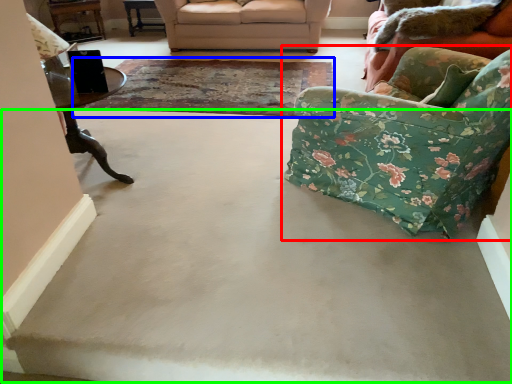
Question: Considering the real-world distances, which object is closest to chair (highlighted by a red box)? mat (highlighted by a blue box) or concrete (highlighted by a green box).

Choices:
 (A) mat
 (B) concrete

Answer: (B)